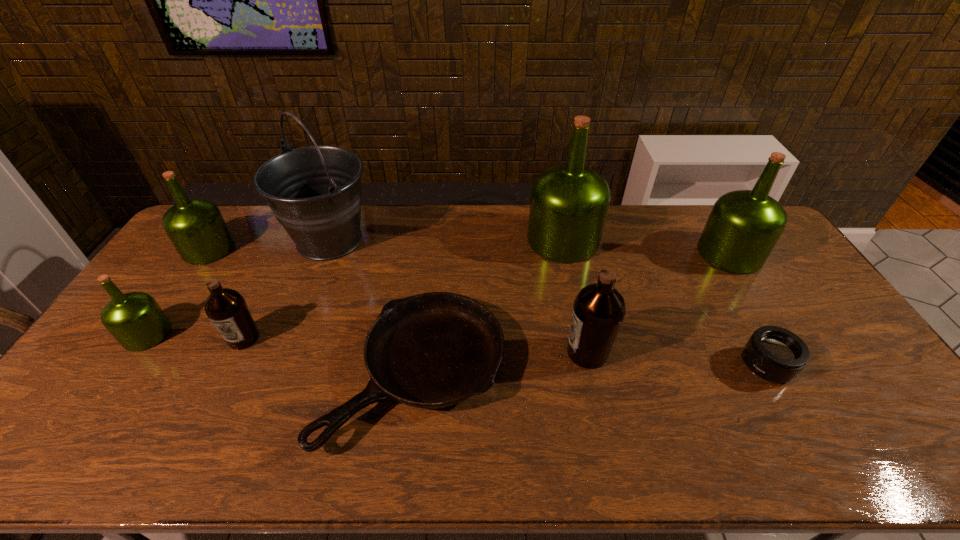
Locate an element on the screen. free point located on the label of the left brown olive oil is located at coordinates coord(183,464).

Where is `blank area located 0.140m on the front of the smallest green olive oil`? This screenshot has height=540, width=960. blank area located 0.140m on the front of the smallest green olive oil is located at coordinates (104, 397).

This screenshot has width=960, height=540. What are the coordinates of `vacant area situated 0.050m on the side of the telephoto lens with brand markings and control switches` in the screenshot? It's located at (722, 365).

Locate an element on the screen. blank space located 0.130m on the side of the telephoto lens with brand markings and control switches is located at coordinates [692, 365].

Where is `free space located on the side of the telephoto lens with brand markings and control switches`? This screenshot has height=540, width=960. free space located on the side of the telephoto lens with brand markings and control switches is located at coordinates (670, 365).

I want to click on free space located 0.230m on the back of the frying pan, so [x=430, y=258].

Find the location of a particular element. bucket situated at the far edge is located at coordinates (315, 193).

The image size is (960, 540). Find the location of `object that is at the near edge`. object that is at the near edge is located at coordinates (433, 350).

In order to click on object at the right edge in this screenshot , I will do `click(743, 227)`.

Locate an element on the screen. This screenshot has height=540, width=960. object located at the far left corner is located at coordinates (196, 227).